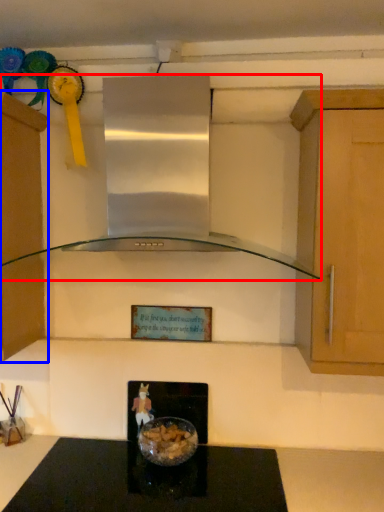
Question: Which object appears closest to the camera in this image, home appliance (highlighted by a red box) or cabinetry (highlighted by a blue box)?

Choices:
 (A) home appliance
 (B) cabinetry

Answer: (A)